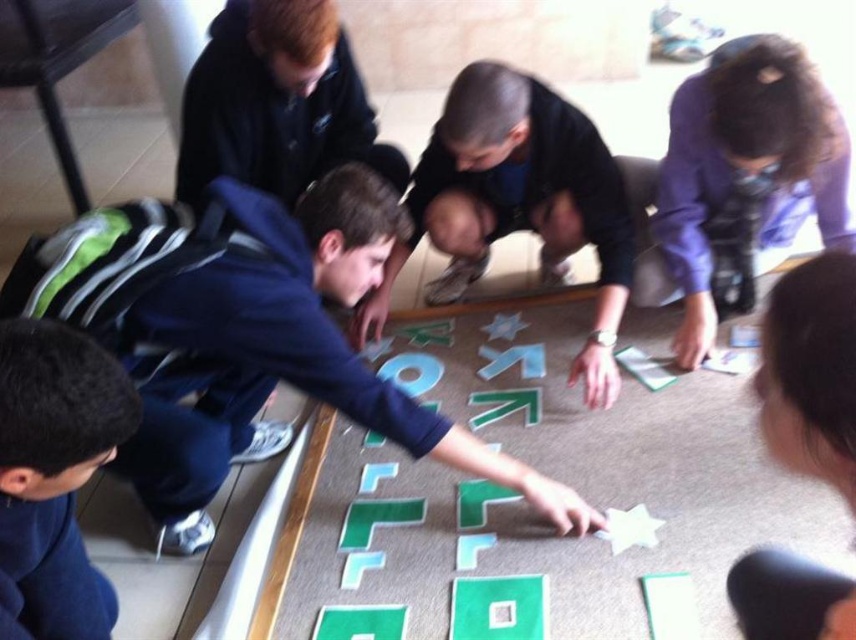
You are a photographer trying to capture a candid shot of the dark blue shirt at center and the black matte hair at lower left. Since you want both subjects to be in focus, you need to know if they are at the same distance from the camera. Can you determine if they are at the same distance based on their positions?

The dark blue shirt at center is positioned over black matte hair at lower left, meaning they are at different distances from the camera. The dark blue shirt at center is closer, so they won